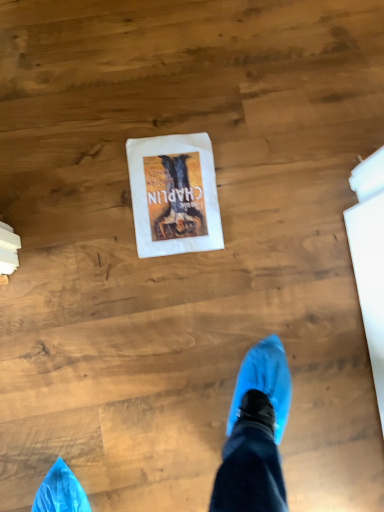
The height and width of the screenshot is (512, 384). I want to click on free spot below white paper at center (from a real-world perspective), so click(174, 197).